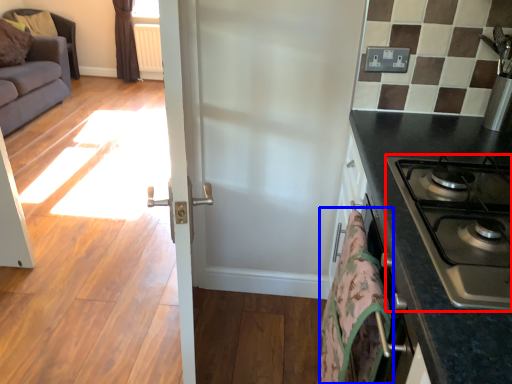
Question: Which point is closer to the camera, gas stove (highlighted by a red box) or blanket (highlighted by a blue box)?

Choices:
 (A) gas stove
 (B) blanket

Answer: (A)